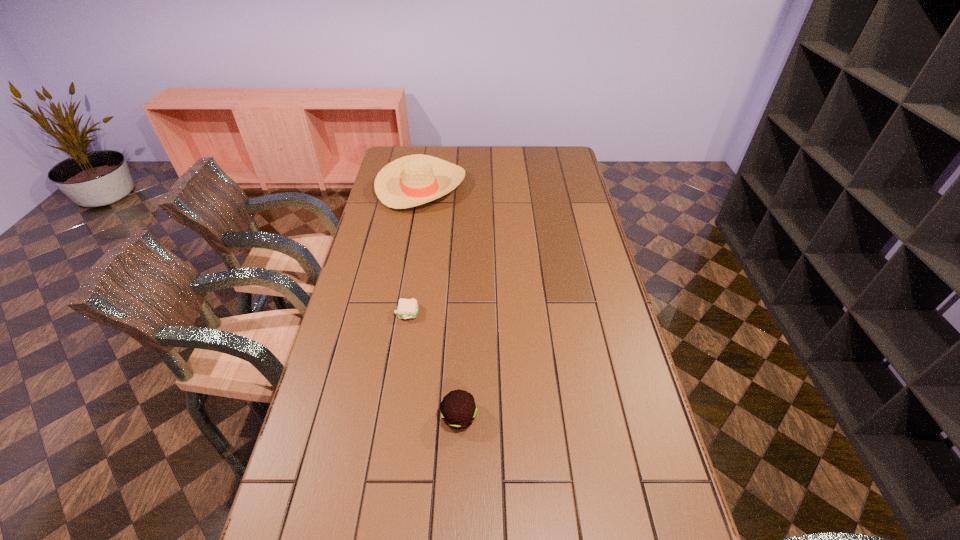
Where is `the farthest object`? The image size is (960, 540). the farthest object is located at coordinates (409, 181).

You are a GUI agent. You are given a task and a screenshot of the screen. Output one action in this format:
    pyautogui.click(x=<x>, y=<y>)
    Task: Click on the tallest object
    The width and height of the screenshot is (960, 540).
    Given the screenshot: What is the action you would take?
    pyautogui.click(x=409, y=181)

This screenshot has width=960, height=540. What are the coordinates of `the taller patty` in the screenshot? It's located at (458, 409).

The width and height of the screenshot is (960, 540). What are the coordinates of `the right patty` in the screenshot? It's located at (458, 409).

Identify the location of the shorter patty. This screenshot has height=540, width=960. (407, 308).

This screenshot has width=960, height=540. I want to click on the shortest object, so click(407, 308).

Find the location of a particular element. vacant space situated 0.170m on the back of the sunhat is located at coordinates (429, 146).

Find the location of a particular element. The image size is (960, 540). vacant region located on the left of the nearest object is located at coordinates (421, 417).

Where is `free space located 0.120m on the back of the second nearest object`? This screenshot has height=540, width=960. free space located 0.120m on the back of the second nearest object is located at coordinates (413, 278).

At what (x,y) coordinates should I click in order to perform the action: click on object present at the far edge. Please return your answer as a coordinate pair (x, y). The image size is (960, 540). Looking at the image, I should click on (409, 181).